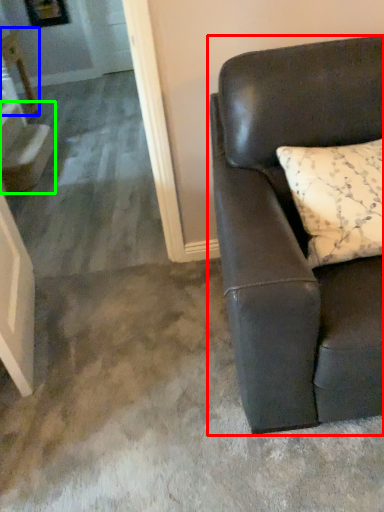
Question: Estimate the real-world distances between objects in this image. Which object is farther from studio couch (highlighted by a red box), table (highlighted by a blue box) or stairwell (highlighted by a green box)?

Choices:
 (A) table
 (B) stairwell

Answer: (A)